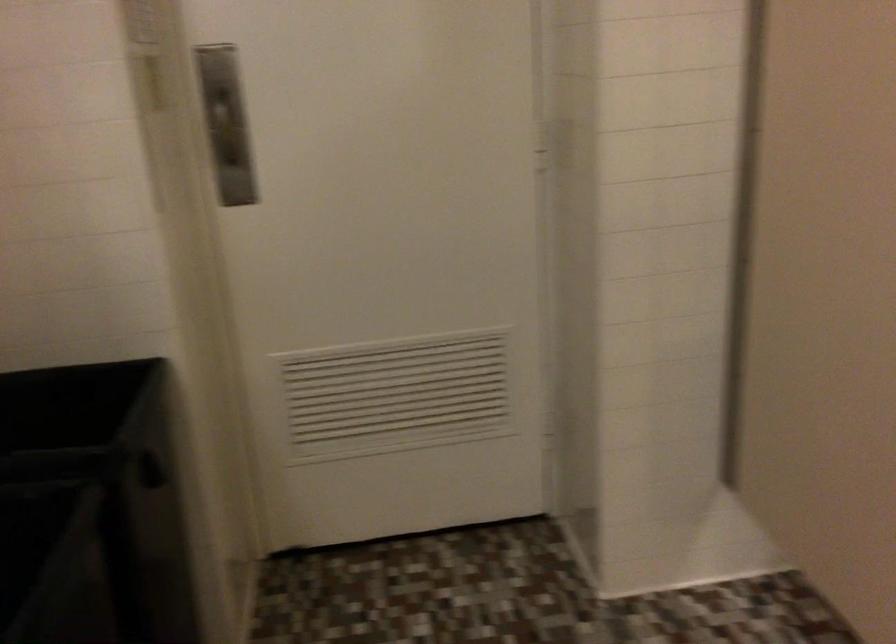
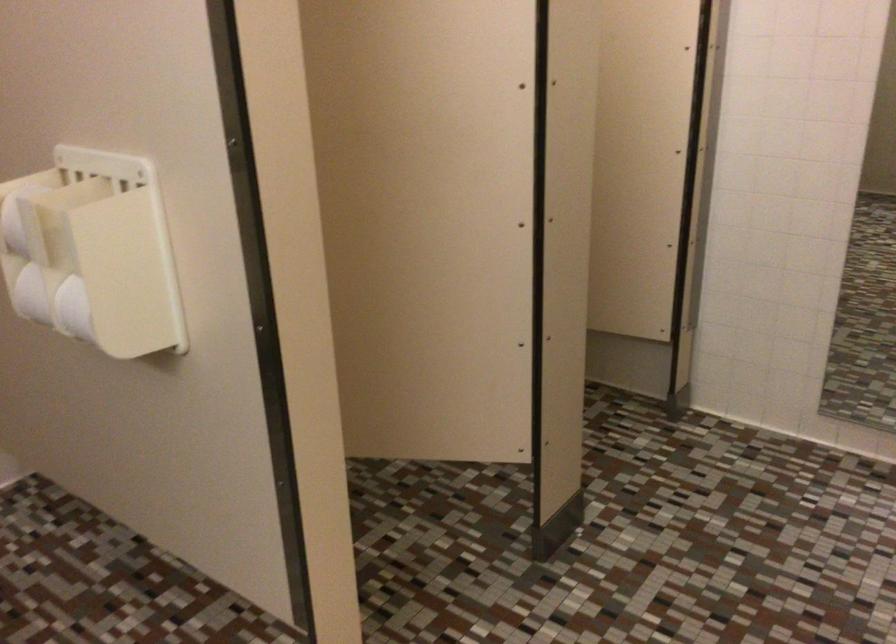
Question: The images are taken continuously from a first-person perspective. In which direction is your viewpoint rotating?

Choices:
 (A) Left
 (B) Right
 (C) Up
 (D) Down

Answer: (B)